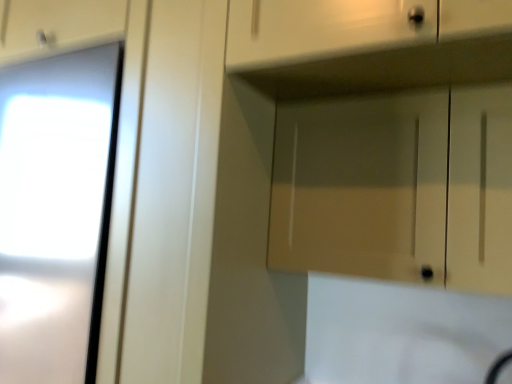
You are a GUI agent. You are given a task and a screenshot of the screen. Output one action in this format:
    pyautogui.click(x=<x>, y=<y>)
    Task: Click on the matte wood cabinet at upper center
    This screenshot has height=384, width=512.
    Given the screenshot: What is the action you would take?
    pyautogui.click(x=397, y=187)

Describe the element at coordinates (397, 187) in the screenshot. I see `matte wood cabinet at upper center` at that location.

Image resolution: width=512 pixels, height=384 pixels. In order to click on matte white drawer at upper right in this screenshot , I will do `click(352, 28)`.

Image resolution: width=512 pixels, height=384 pixels. Describe the element at coordinates (352, 28) in the screenshot. I see `matte white drawer at upper right` at that location.

Locate an element on the screen. This screenshot has height=384, width=512. matte wood cabinet at upper center is located at coordinates (397, 187).

In the scene shown: Can you confirm if matte wood cabinet at upper center is positioned to the left of matte white drawer at upper right?

No, matte wood cabinet at upper center is not to the left of matte white drawer at upper right.

Which object is closer to the camera taking this photo, matte wood cabinet at upper center or matte white drawer at upper right?

matte white drawer at upper right is closer to the camera.

Is point (464, 150) positioned before point (505, 1)?

No, it is behind (505, 1).

From the image's perspective, which object appears higher, matte wood cabinet at upper center or matte white drawer at upper right?

matte white drawer at upper right is shown above in the image.

From a real-world perspective, does matte wood cabinet at upper center stand above matte white drawer at upper right?

Actually, matte wood cabinet at upper center is physically below matte white drawer at upper right in the real world.

Can you confirm if matte wood cabinet at upper center is thinner than matte white drawer at upper right?

Yes.

Who is shorter, matte wood cabinet at upper center or matte white drawer at upper right?

matte white drawer at upper right is shorter.

Considering the sizes of objects matte wood cabinet at upper center and matte white drawer at upper right in the image provided, who is smaller, matte wood cabinet at upper center or matte white drawer at upper right?

Smaller between the two is matte wood cabinet at upper center.

Can we say matte wood cabinet at upper center lies outside matte white drawer at upper right?

matte wood cabinet at upper center is positioned outside matte white drawer at upper right.

Looking at this image, is matte wood cabinet at upper center next to matte white drawer at upper right and touching it?

matte wood cabinet at upper center and matte white drawer at upper right are not in contact.

Is matte wood cabinet at upper center looking in the opposite direction of matte white drawer at upper right?

No, matte white drawer at upper right is not at the back of matte wood cabinet at upper center.

The width and height of the screenshot is (512, 384). I want to click on cabinetry on the right of matte white drawer at upper right, so click(397, 187).

Visually, is matte white drawer at upper right positioned to the left or to the right of matte wood cabinet at upper center?

In the image, matte white drawer at upper right appears on the left side of matte wood cabinet at upper center.

Is the position of matte white drawer at upper right less distant than that of matte wood cabinet at upper center?

Yes, matte white drawer at upper right is in front of matte wood cabinet at upper center.

Considering the points (298, 5) and (350, 192), which point is behind, point (298, 5) or point (350, 192)?

The point (350, 192) is farther from the camera.

From the image's perspective, between matte white drawer at upper right and matte wood cabinet at upper center, which one is located above?

matte white drawer at upper right.

From a real-world perspective, is matte white drawer at upper right physically below matte wood cabinet at upper center?

No.

Does matte white drawer at upper right have a lesser width compared to matte wood cabinet at upper center?

No, matte white drawer at upper right is not thinner than matte wood cabinet at upper center.

Considering the sizes of matte white drawer at upper right and matte wood cabinet at upper center in the image, is matte white drawer at upper right taller or shorter than matte wood cabinet at upper center?

matte white drawer at upper right is shorter than matte wood cabinet at upper center.

Can you confirm if matte white drawer at upper right is smaller than matte wood cabinet at upper center?

Actually, matte white drawer at upper right might be larger than matte wood cabinet at upper center.

Do you think matte white drawer at upper right is within matte wood cabinet at upper center, or outside of it?

matte white drawer at upper right is not enclosed by matte wood cabinet at upper center.

Is matte white drawer at upper right not close to matte wood cabinet at upper center?

They are positioned close to each other.

Is matte white drawer at upper right facing towards matte wood cabinet at upper center?

No, matte white drawer at upper right is not facing towards matte wood cabinet at upper center.

How much distance is there between matte white drawer at upper right and matte wood cabinet at upper center?

matte white drawer at upper right is 11.90 inches from matte wood cabinet at upper center.

Where is `cabinetry behind the matte white drawer at upper right`? Image resolution: width=512 pixels, height=384 pixels. cabinetry behind the matte white drawer at upper right is located at coordinates (397, 187).

Locate an element on the screen. The width and height of the screenshot is (512, 384). cabinetry below the matte white drawer at upper right (from a real-world perspective) is located at coordinates (397, 187).

Find the location of a particular element. cabinetry located on the right of matte white drawer at upper right is located at coordinates (397, 187).